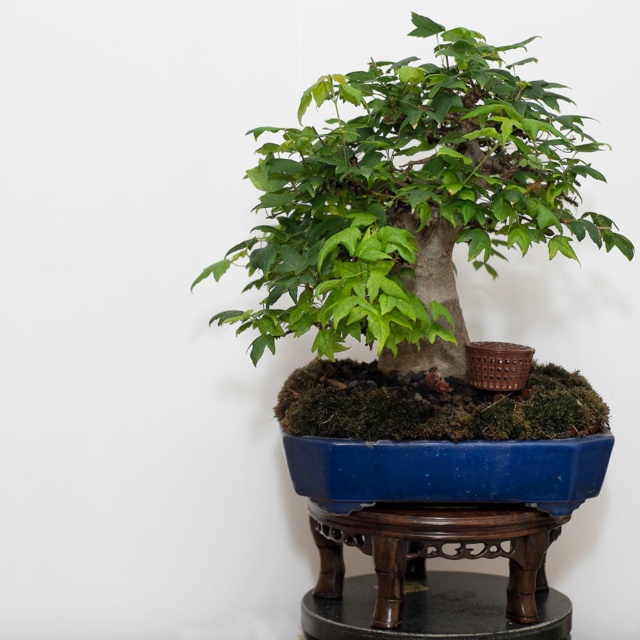
Who is positioned more to the right, green matte bonsai tree at center or wooden stand at center?

From the viewer's perspective, wooden stand at center appears more on the right side.

Locate an element on the screen. green matte bonsai tree at center is located at coordinates (410, 198).